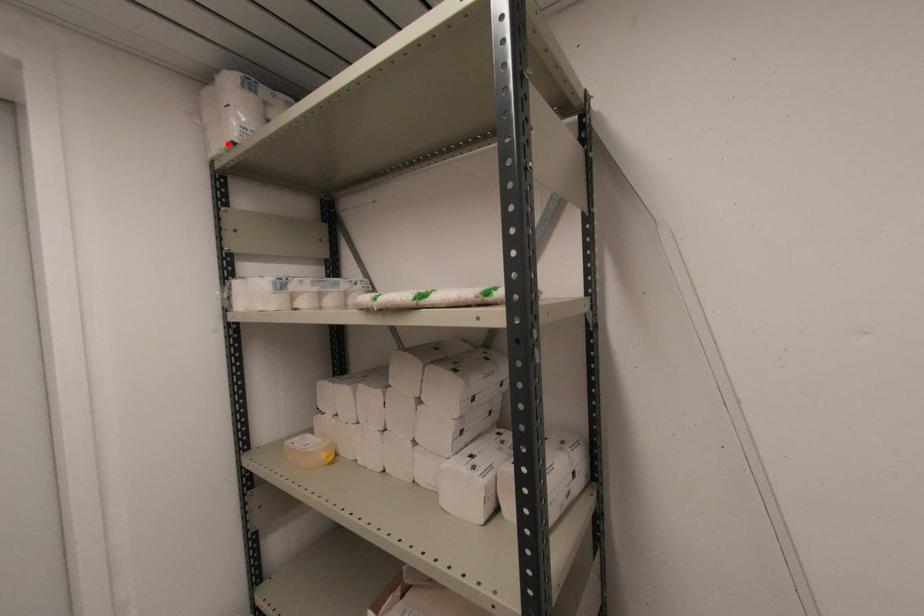
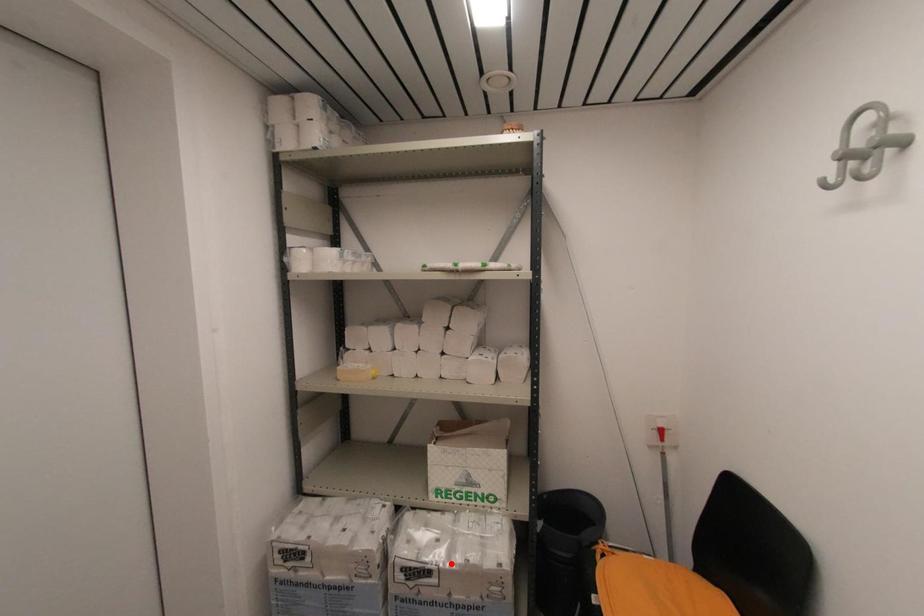
I am providing you with two images of the same scene from different viewpoints. A red point is marked on the first image and another point is marked on the second image. Is the red point in image1 aligned with the point shown in image2?

No